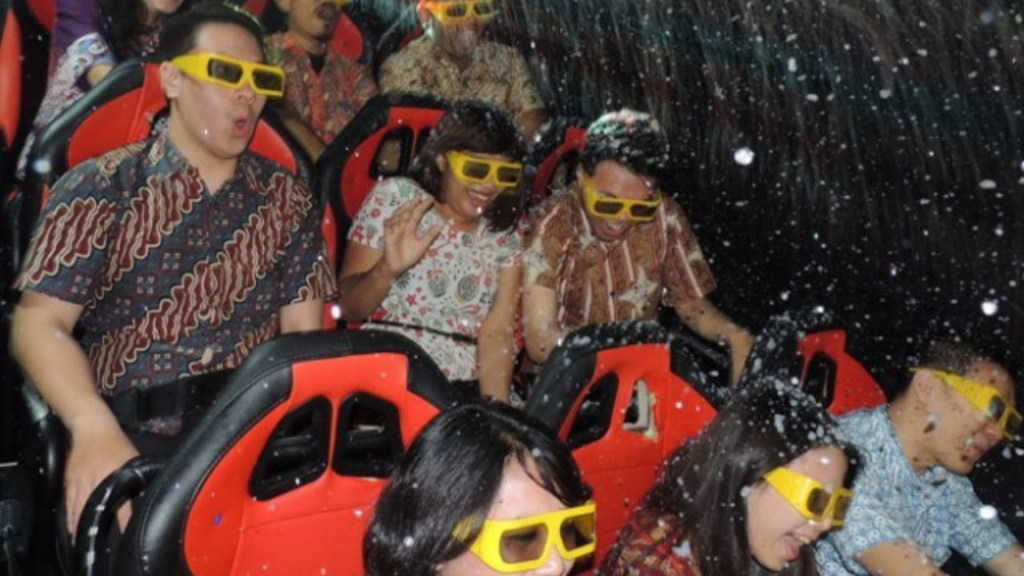
Find the location of `red seat`. red seat is located at coordinates (312, 506).